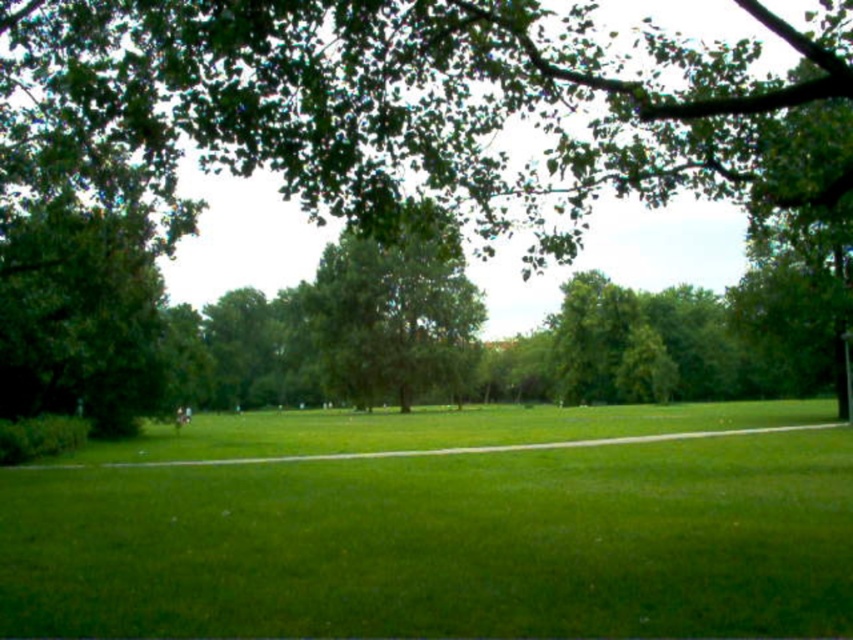
You are planning to set up a picnic blanket in the park. The picnic blanket is 2 meters wide. You see the green grass at center and the green leafy tree at left. Which area would be suitable for placing the blanket without overlapping any obstacles?

The green grass at center has a greater width than the green leafy tree at left, so the green grass at center would be suitable for placing the picnic blanket as it provides enough space without overlapping obstacles.

You are standing at the point with coordinates point (660, 115) and want to walk to the point with coordinates point (335, 508). Is the destination point visible from your current position?

Point (335, 508) is behind point (660, 115), so the destination point is not visible from your current position.

You are standing in the park and want to take a photo of the green leafy tree at upper center. If your camera has a maximum focus range of 20 feet, will you be able to capture it clearly?

The green leafy tree at upper center is 19.30 feet away from the viewer, which is within the camera maximum focus range of 20 feet. Therefore, you can capture it clearly.